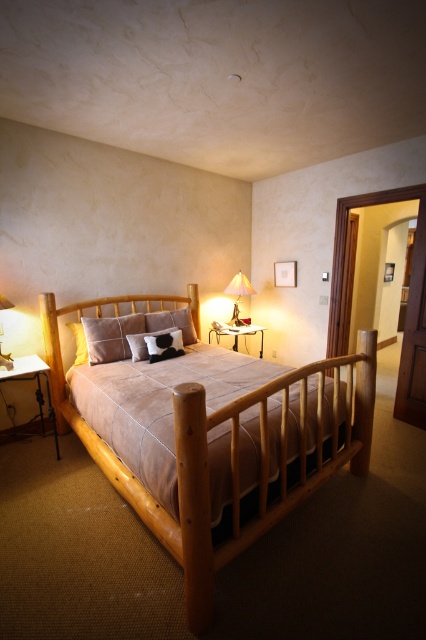
You are trying to decide whether to place a tall floor lamp in the bedroom. The lamp is 1.8 meters tall. Considering the brown leather bed at center and the cow print fabric pillow at center, which object is taller and can the lamp fit without touching the ceiling?

The brown leather bed at center is taller than the cow print fabric pillow at center. Since the bed is taller than the pillow, and assuming the ceiling height accommodates the lamp, the lamp can fit as long as it doesn not exceed the ceiling height.